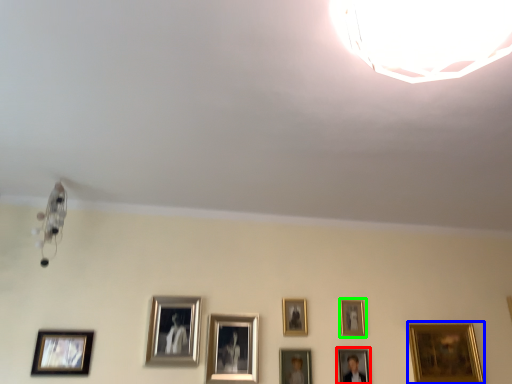
Question: Considering the real-world distances, which object is closest to picture frame (highlighted by a red box)? picture frame (highlighted by a blue box) or picture frame (highlighted by a green box).

Choices:
 (A) picture frame
 (B) picture frame

Answer: (B)